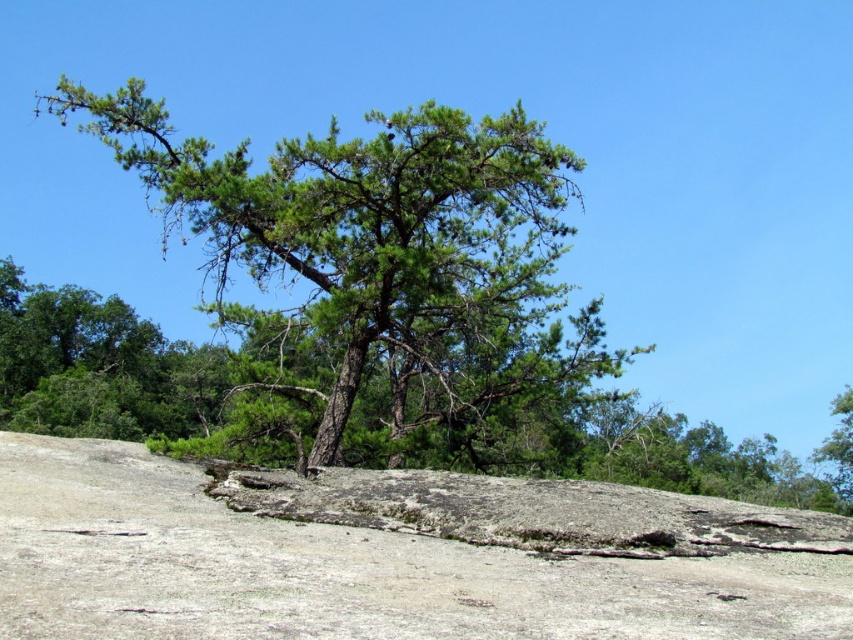
Question: Observing the image, what is the correct spatial positioning of green needle-like at center in reference to green leafy tree at upper right?

Choices:
 (A) below
 (B) above

Answer: (B)

Question: Does green needle-like at center have a larger size compared to gray rock at center?

Choices:
 (A) yes
 (B) no

Answer: (A)

Question: Estimate the real-world distances between objects in this image. Which object is closer to the green leafy tree at upper right?

Choices:
 (A) green needle-like at center
 (B) gray rock at center

Answer: (A)

Question: Among these objects, which one is nearest to the camera?

Choices:
 (A) green needle-like at center
 (B) green leafy tree at upper right
 (C) gray rock at center

Answer: (C)

Question: Is gray rock at center smaller than green leafy tree at upper right?

Choices:
 (A) no
 (B) yes

Answer: (B)

Question: Among these objects, which one is farthest from the camera?

Choices:
 (A) gray rock at center
 (B) green needle-like at center

Answer: (B)